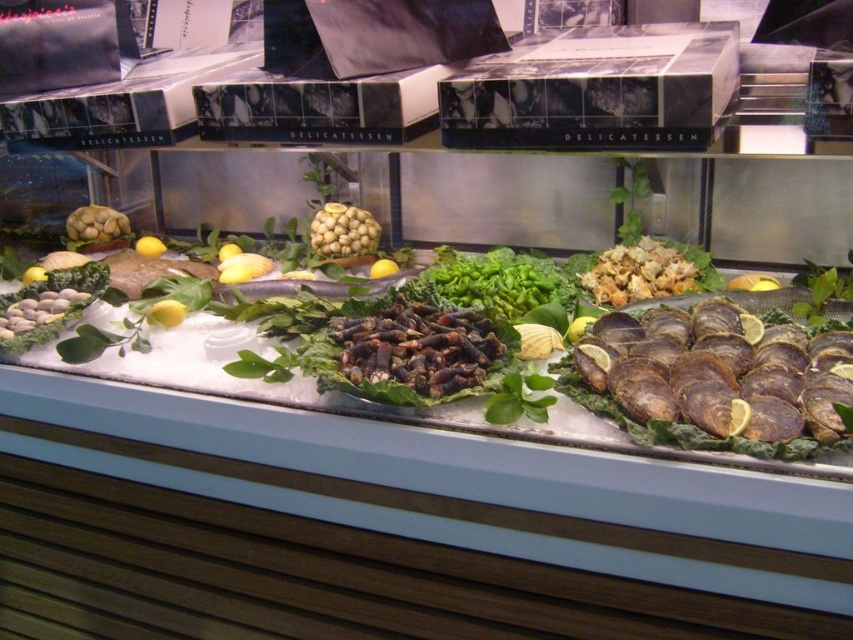
Between brown textured oysters at center and green leafy vegetable at center, which one has more height?

With more height is brown textured oysters at center.

Does brown textured oysters at center have a lesser height compared to green leafy vegetable at center?

Result: No, brown textured oysters at center is not shorter than green leafy vegetable at center.

What do you see at coordinates (718, 371) in the screenshot? I see `brown textured oysters at center` at bounding box center [718, 371].

Where is `brown textured oysters at center`? Image resolution: width=853 pixels, height=640 pixels. brown textured oysters at center is located at coordinates (718, 371).

Which of these two, green leafy vegetable at center or green matte artichoke at left, stands shorter?

With less height is green matte artichoke at left.

Does green leafy vegetable at center have a greater height compared to green matte artichoke at left?

Indeed, green leafy vegetable at center has a greater height compared to green matte artichoke at left.

Does point (500, 266) lie in front of point (86, 234)?

Yes.

At what (x,y) coordinates should I click in order to perform the action: click on green leafy vegetable at center. Please return your answer as a coordinate pair (x, y). The width and height of the screenshot is (853, 640). Looking at the image, I should click on [497, 282].

Does point (471, 291) lie behind point (328, 253)?

No.

Between green leafy vegetable at center and smooth beige nuts at center, which one has more height?

green leafy vegetable at center is taller.

I want to click on green leafy vegetable at center, so click(497, 282).